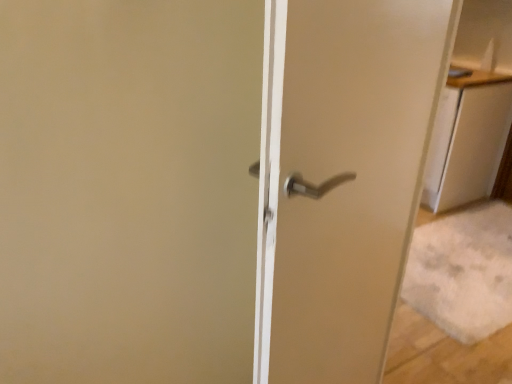
Question: Can you confirm if white glossy cabinet at upper right is wider than satin silver handle at center?

Choices:
 (A) no
 (B) yes

Answer: (B)

Question: Is white glossy cabinet at upper right positioned behind satin silver handle at center?

Choices:
 (A) no
 (B) yes

Answer: (B)

Question: Can we say white glossy cabinet at upper right lies outside satin silver handle at center?

Choices:
 (A) no
 (B) yes

Answer: (B)

Question: Is white glossy cabinet at upper right looking in the opposite direction of satin silver handle at center?

Choices:
 (A) yes
 (B) no

Answer: (B)

Question: Does white glossy cabinet at upper right appear on the left side of satin silver handle at center?

Choices:
 (A) no
 (B) yes

Answer: (A)

Question: Can you confirm if white glossy cabinet at upper right is thinner than satin silver handle at center?

Choices:
 (A) no
 (B) yes

Answer: (A)

Question: Considering the relative positions of satin silver handle at center and white glossy cabinet at upper right in the image provided, is satin silver handle at center in front of white glossy cabinet at upper right?

Choices:
 (A) yes
 (B) no

Answer: (A)

Question: From a real-world perspective, is satin silver handle at center physically above white glossy cabinet at upper right?

Choices:
 (A) no
 (B) yes

Answer: (B)

Question: Is satin silver handle at center bigger than white glossy cabinet at upper right?

Choices:
 (A) no
 (B) yes

Answer: (B)

Question: Is satin silver handle at center wider than white glossy cabinet at upper right?

Choices:
 (A) yes
 (B) no

Answer: (B)

Question: Is satin silver handle at center located outside white glossy cabinet at upper right?

Choices:
 (A) yes
 (B) no

Answer: (A)

Question: From a real-world perspective, is satin silver handle at center positioned under white glossy cabinet at upper right based on gravity?

Choices:
 (A) yes
 (B) no

Answer: (B)

Question: From a real-world perspective, is satin silver handle at center above or below white glossy cabinet at upper right?

Choices:
 (A) above
 (B) below

Answer: (A)